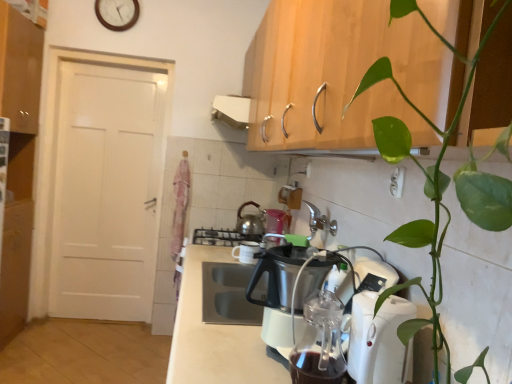
Image resolution: width=512 pixels, height=384 pixels. Describe the element at coordinates (397, 182) in the screenshot. I see `white plastic electric outlet at upper center` at that location.

Image resolution: width=512 pixels, height=384 pixels. I want to click on white plastic kettle at lower right, marked as the 1th kitchen appliance in a front-to-back arrangement, so click(379, 340).

Describe the element at coordinates (20, 69) in the screenshot. I see `matte wood cabinet at upper left` at that location.

Where is `matte wood cabinet at upper left`? The width and height of the screenshot is (512, 384). matte wood cabinet at upper left is located at coordinates (20, 69).

What is the approximate height of shiny metallic kettle at center, acting as the first kitchen appliance starting from the back?

shiny metallic kettle at center, acting as the first kitchen appliance starting from the back, is 9.52 inches tall.

The height and width of the screenshot is (384, 512). Identify the location of shiny metallic kettle at center, arranged as the second kitchen appliance when viewed from the front. (250, 221).

This screenshot has width=512, height=384. I want to click on white plastic electric outlet at upper center, so click(397, 182).

Find the location of a particular element. electric outlet that is above the white plastic kettle at lower right, positioned as the first kitchen appliance in right-to-left order (from the image's perspective) is located at coordinates pos(397,182).

Is white plastic electric outlet at upper center looking in the opposite direction of white plastic kettle at lower right, marked as the second kitchen appliance in a left-to-right arrangement?

No, white plastic kettle at lower right, marked as the second kitchen appliance in a left-to-right arrangement, is not at the back of white plastic electric outlet at upper center.

Can you confirm if white plastic electric outlet at upper center is positioned to the left of white plastic kettle at lower right, positioned as the first kitchen appliance in right-to-left order?

Incorrect, white plastic electric outlet at upper center is not on the left side of white plastic kettle at lower right, positioned as the first kitchen appliance in right-to-left order.

Is white plastic electric outlet at upper center positioned in front of white plastic kettle at lower right, positioned as the first kitchen appliance in right-to-left order?

No, the depth of white plastic electric outlet at upper center is greater than that of white plastic kettle at lower right, positioned as the first kitchen appliance in right-to-left order.

Are shiny metallic kettle at center, placed as the 1th kitchen appliance when sorted from left to right, and matte wood cabinet at upper left beside each other?

shiny metallic kettle at center, placed as the 1th kitchen appliance when sorted from left to right, is not next to matte wood cabinet at upper left, and they're not touching.

Does shiny metallic kettle at center, arranged as the second kitchen appliance when viewed from the front, appear on the right side of matte wood cabinet at upper left?

Correct, you'll find shiny metallic kettle at center, arranged as the second kitchen appliance when viewed from the front, to the right of matte wood cabinet at upper left.

From the picture: Is white wooden clock at upper center taller than shiny metallic kettle at center, placed as the 1th kitchen appliance when sorted from left to right?

Indeed, white wooden clock at upper center has a greater height compared to shiny metallic kettle at center, placed as the 1th kitchen appliance when sorted from left to right.

Are white wooden clock at upper center and shiny metallic kettle at center, placed as the 1th kitchen appliance when sorted from left to right, located far from each other?

Absolutely, white wooden clock at upper center is distant from shiny metallic kettle at center, placed as the 1th kitchen appliance when sorted from left to right.

From the image's perspective, is white wooden clock at upper center above shiny metallic kettle at center, acting as the first kitchen appliance starting from the back?

Yes, from the image's perspective, white wooden clock at upper center is over shiny metallic kettle at center, acting as the first kitchen appliance starting from the back.

Where is `cabinetry lying on the left of white plastic countertop at center`? This screenshot has height=384, width=512. cabinetry lying on the left of white plastic countertop at center is located at coordinates (20, 69).

How many degrees apart are the facing directions of white plastic countertop at center and matte wood cabinet at upper left?

They differ by 179 degrees in their facing directions.

Which point is more distant from viewer, (204, 326) or (26, 114)?

The point (26, 114) is behind.

Between white plastic countertop at center and matte wood cabinet at upper left, which one appears on the right side from the viewer's perspective?

Positioned to the right is white plastic countertop at center.

Who is taller, white plastic electric outlet at upper center or white wooden clock at upper center?

white wooden clock at upper center is taller.

Is white plastic electric outlet at upper center completely or partially outside of white wooden clock at upper center?

Yes, white plastic electric outlet at upper center is located beyond the bounds of white wooden clock at upper center.

Is white plastic electric outlet at upper center placed right next to white wooden clock at upper center?

No, white plastic electric outlet at upper center is not making contact with white wooden clock at upper center.

From a real-world perspective, is white plastic electric outlet at upper center above or below white wooden clock at upper center?

From a real-world perspective, white plastic electric outlet at upper center is physically below white wooden clock at upper center.

From the image's perspective, count 1st kitchen appliances downward from the white plastic electric outlet at upper center and point to it. Please provide its 2D coordinates.

[(250, 221)]

In the scene shown: Choose the correct answer: Is shiny metallic kettle at center, arranged as the second kitchen appliance when viewed from the front, inside white plastic electric outlet at upper center or outside it?

shiny metallic kettle at center, arranged as the second kitchen appliance when viewed from the front, cannot be found inside white plastic electric outlet at upper center.

From the picture: Between shiny metallic kettle at center, acting as the first kitchen appliance starting from the back, and white plastic electric outlet at upper center, which one appears on the left side from the viewer's perspective?

shiny metallic kettle at center, acting as the first kitchen appliance starting from the back.

Is shiny metallic kettle at center, placed as the 1th kitchen appliance when sorted from left to right, oriented away from white plastic electric outlet at upper center?

shiny metallic kettle at center, placed as the 1th kitchen appliance when sorted from left to right, does not have its back to white plastic electric outlet at upper center.

Between white wooden clock at upper center and white plastic kettle at lower right, positioned as the first kitchen appliance in right-to-left order, which one has larger width?

With larger width is white plastic kettle at lower right, positioned as the first kitchen appliance in right-to-left order.

Which point is more forward, (x=132, y=24) or (x=362, y=335)?

Point (x=362, y=335)

From a real-world perspective, is white wooden clock at upper center physically located above or below white plastic kettle at lower right, marked as the second kitchen appliance in a left-to-right arrangement?

white wooden clock at upper center is situated higher than white plastic kettle at lower right, marked as the second kitchen appliance in a left-to-right arrangement, in the real world.

Is white wooden clock at upper center to the left of white plastic kettle at lower right, positioned as the first kitchen appliance in right-to-left order, from the viewer's perspective?

Yes.

At what (x,y) coordinates should I click in order to perform the action: click on electric outlet on the right of the white plastic kettle at lower right, positioned as the first kitchen appliance in right-to-left order. Please return your answer as a coordinate pair (x, y). This screenshot has width=512, height=384. Looking at the image, I should click on pyautogui.click(x=397, y=182).

In order to click on the 2nd kitchen appliance located beneath the matte wood cabinet at upper left (from a real-world perspective) in this screenshot , I will do `click(250, 221)`.

Which object lies nearer to the anchor point white wooden clock at upper center, white plastic kettle at lower right, which appears as the second kitchen appliance when viewed from the back, or shiny metallic kettle at center, placed as the 1th kitchen appliance when sorted from left to right?

shiny metallic kettle at center, placed as the 1th kitchen appliance when sorted from left to right, is closer to white wooden clock at upper center.

When comparing their distances from matte wood cabinet at upper left, does shiny metallic kettle at center, placed as the 1th kitchen appliance when sorted from left to right, or white plastic countertop at center seem further?

shiny metallic kettle at center, placed as the 1th kitchen appliance when sorted from left to right, is further to matte wood cabinet at upper left.

Considering their positions, is white plastic kettle at lower right, marked as the 1th kitchen appliance in a front-to-back arrangement, positioned further to white plastic countertop at center than white plastic electric outlet at upper center?

white plastic electric outlet at upper center lies further to white plastic countertop at center than the other object.

From the image, which object appears to be farther from white plastic electric outlet at upper center, white plastic countertop at center or white plastic kettle at lower right, positioned as the first kitchen appliance in right-to-left order?

white plastic countertop at center lies further to white plastic electric outlet at upper center than the other object.

Considering their positions, is white wooden clock at upper center positioned closer to shiny metallic kettle at center, the second kitchen appliance when ordered from right to left, than matte wood cabinet at upper left?

white wooden clock at upper center.

From the image, which object appears to be farther from white plastic kettle at lower right, marked as the second kitchen appliance in a left-to-right arrangement, matte wood cabinet at upper left or white plastic electric outlet at upper center?

matte wood cabinet at upper left.

Based on their spatial positions, is matte wood cabinet at upper left or shiny metallic kettle at center, arranged as the second kitchen appliance when viewed from the front, closer to white plastic kettle at lower right, marked as the 1th kitchen appliance in a front-to-back arrangement?

shiny metallic kettle at center, arranged as the second kitchen appliance when viewed from the front.

When comparing their distances from white plastic electric outlet at upper center, does white plastic kettle at lower right, which appears as the second kitchen appliance when viewed from the back, or shiny metallic kettle at center, the second kitchen appliance when ordered from right to left, seem closer?

The object closer to white plastic electric outlet at upper center is white plastic kettle at lower right, which appears as the second kitchen appliance when viewed from the back.

This screenshot has width=512, height=384. In order to click on countertop located between matte wood cabinet at upper left and white plastic kettle at lower right, marked as the second kitchen appliance in a left-to-right arrangement, in the left-right direction in this screenshot , I will do (x=215, y=335).

Locate an element on the screen. The image size is (512, 384). cabinetry between white plastic kettle at lower right, which appears as the second kitchen appliance when viewed from the back, and shiny metallic kettle at center, acting as the first kitchen appliance starting from the back, from front to back is located at coordinates (20, 69).

In order to click on kitchen appliance between matte wood cabinet at upper left and white plastic countertop at center in this screenshot , I will do `click(250, 221)`.

I want to click on countertop that lies between white plastic electric outlet at upper center and white plastic kettle at lower right, marked as the 1th kitchen appliance in a front-to-back arrangement, from top to bottom, so click(x=215, y=335).